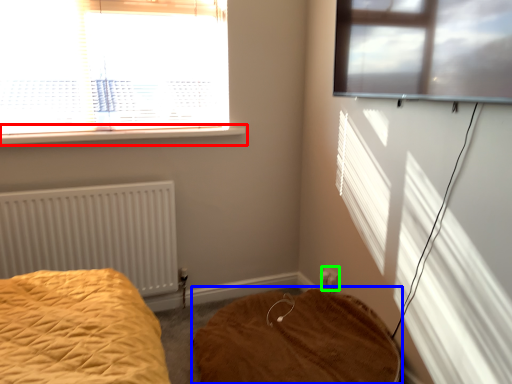
Question: Based on their relative distances, which object is farther from window sill (highlighted by a red box)? Choose from mattress (highlighted by a blue box) and electric outlet (highlighted by a green box).

Choices:
 (A) mattress
 (B) electric outlet

Answer: (B)